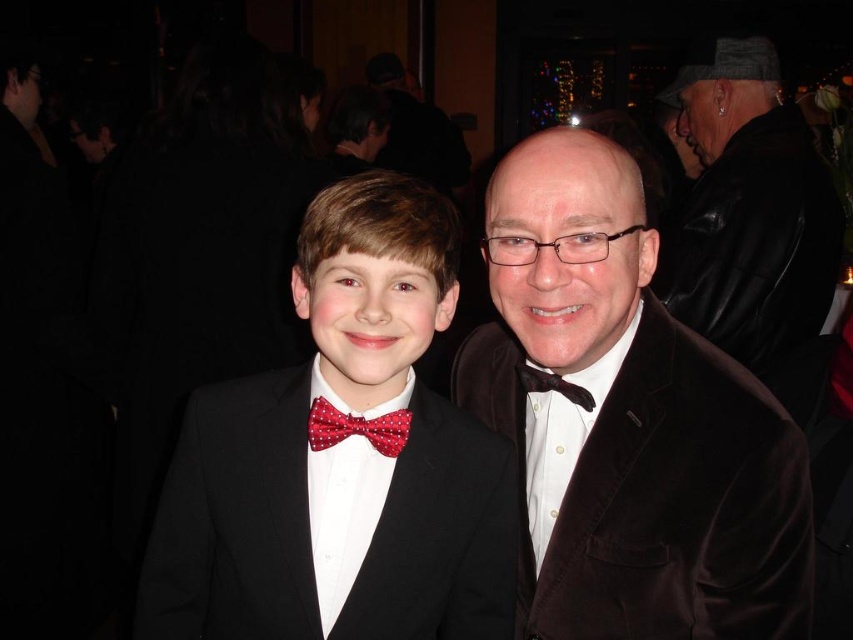
You are attending a formal event and need to find the velvet brown suit at right and the matte black suit at center. Based on their positions in the scene, which one is positioned higher?

The velvet brown suit at right is located above the matte black suit at center, so it is positioned higher.

You are a photographer at a formal event. You need to capture a photo of the red dotted bow tie at center and the black leather jacket at upper right. Which object should you focus on first to ensure both are in frame?

The black leather jacket at upper right is above the red dotted bow tie at center, so you should focus on the red dotted bow tie at center first to ensure both are in frame.